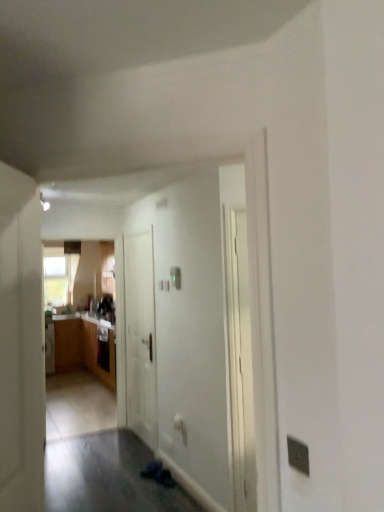
Question: Which direction should I rotate to look at white matte door at center, which appears as the 1th door when viewed from the back, — up or down?

Choices:
 (A) down
 (B) up

Answer: (A)

Question: Can you see white matte door at left, arranged as the first door when viewed from the front, touching wooden cabinet at left?

Choices:
 (A) yes
 (B) no

Answer: (B)

Question: From the image's perspective, would you say white matte door at left, arranged as the first door when viewed from the front, is positioned over wooden cabinet at left?

Choices:
 (A) no
 (B) yes

Answer: (B)

Question: Does white matte door at left, which is the 2th door in back-to-front order, have a smaller size compared to wooden cabinet at left?

Choices:
 (A) no
 (B) yes

Answer: (B)

Question: Is white matte door at left, arranged as the first door when viewed from the front, completely or partially outside of wooden cabinet at left?

Choices:
 (A) yes
 (B) no

Answer: (A)

Question: Is white matte door at left, which is the 2th door in back-to-front order, looking in the opposite direction of wooden cabinet at left?

Choices:
 (A) yes
 (B) no

Answer: (B)

Question: Is wooden cabinet at left surrounded by white matte door at left, which is the 2th door in back-to-front order?

Choices:
 (A) yes
 (B) no

Answer: (B)

Question: From a real-world perspective, does white matte door at center, which appears as the 1th door when viewed from the back, sit lower than wooden cabinet at left?

Choices:
 (A) yes
 (B) no

Answer: (B)

Question: Is white matte door at center, acting as the 2th door starting from the front, smaller than wooden cabinet at left?

Choices:
 (A) no
 (B) yes

Answer: (B)

Question: From a real-world perspective, is white matte door at center, which appears as the 1th door when viewed from the back, on top of wooden cabinet at left?

Choices:
 (A) yes
 (B) no

Answer: (A)

Question: Considering the relative sizes of white matte door at center, which appears as the 1th door when viewed from the back, and wooden cabinet at left in the image provided, is white matte door at center, which appears as the 1th door when viewed from the back, shorter than wooden cabinet at left?

Choices:
 (A) no
 (B) yes

Answer: (A)

Question: Considering the relative sizes of white matte door at center, acting as the 2th door starting from the front, and wooden cabinet at left in the image provided, is white matte door at center, acting as the 2th door starting from the front, bigger than wooden cabinet at left?

Choices:
 (A) no
 (B) yes

Answer: (A)

Question: Is wooden cabinet at left surrounded by white matte door at center, acting as the 2th door starting from the front?

Choices:
 (A) yes
 (B) no

Answer: (B)

Question: Is white matte door at center, acting as the 2th door starting from the front, in contact with white matte door at left, arranged as the first door when viewed from the front?

Choices:
 (A) yes
 (B) no

Answer: (B)